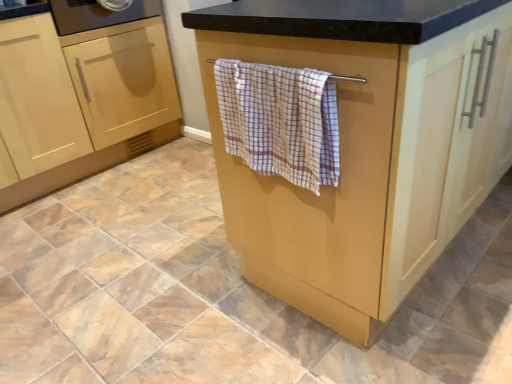
Question: Is matte wood towel rack at center, acting as the first cabinetry starting from the right, not within light wood cabinet at left, the second cabinetry viewed from the left?

Choices:
 (A) no
 (B) yes

Answer: (B)

Question: Is matte wood towel rack at center, marked as the 3th cabinetry in a left-to-right arrangement, wider than light wood cabinet at left, the second cabinetry viewed from the left?

Choices:
 (A) yes
 (B) no

Answer: (A)

Question: Does matte wood towel rack at center, marked as the 3th cabinetry in a left-to-right arrangement, contain light wood cabinet at left, the 2th cabinetry from the right?

Choices:
 (A) yes
 (B) no

Answer: (B)

Question: Can you confirm if matte wood towel rack at center, marked as the 3th cabinetry in a left-to-right arrangement, is bigger than light wood cabinet at left, the 2th cabinetry from the right?

Choices:
 (A) yes
 (B) no

Answer: (A)

Question: Is light wood cabinet at left, the second cabinetry viewed from the left, at the back of matte wood towel rack at center, acting as the first cabinetry starting from the right?

Choices:
 (A) yes
 (B) no

Answer: (A)

Question: From a real-world perspective, is matte wood towel rack at center, acting as the first cabinetry starting from the right, on top of light wood cabinet at left, the second cabinetry viewed from the left?

Choices:
 (A) yes
 (B) no

Answer: (A)

Question: From a real-world perspective, is light wood cabinet at left, the second cabinetry viewed from the left, located beneath matte wood towel rack at center, marked as the 3th cabinetry in a left-to-right arrangement?

Choices:
 (A) no
 (B) yes

Answer: (B)

Question: Does light wood cabinet at left, the second cabinetry viewed from the left, contain matte wood towel rack at center, acting as the first cabinetry starting from the right?

Choices:
 (A) no
 (B) yes

Answer: (A)

Question: Is light wood cabinet at left, the 2th cabinetry from the right, to the right of matte wood towel rack at center, acting as the first cabinetry starting from the right, from the viewer's perspective?

Choices:
 (A) yes
 (B) no

Answer: (B)

Question: Does light wood cabinet at left, the second cabinetry viewed from the left, lie behind matte wood towel rack at center, acting as the first cabinetry starting from the right?

Choices:
 (A) yes
 (B) no

Answer: (A)

Question: Can you confirm if light wood cabinet at left, the 2th cabinetry from the right, is wider than matte wood towel rack at center, marked as the 3th cabinetry in a left-to-right arrangement?

Choices:
 (A) no
 (B) yes

Answer: (A)

Question: Is light wood cabinet at left, the 2th cabinetry from the right, facing away from matte wood towel rack at center, marked as the 3th cabinetry in a left-to-right arrangement?

Choices:
 (A) yes
 (B) no

Answer: (B)

Question: Does checkered cotton towel at center lie in front of light wood cabinet at left, the second cabinetry viewed from the left?

Choices:
 (A) no
 (B) yes

Answer: (B)